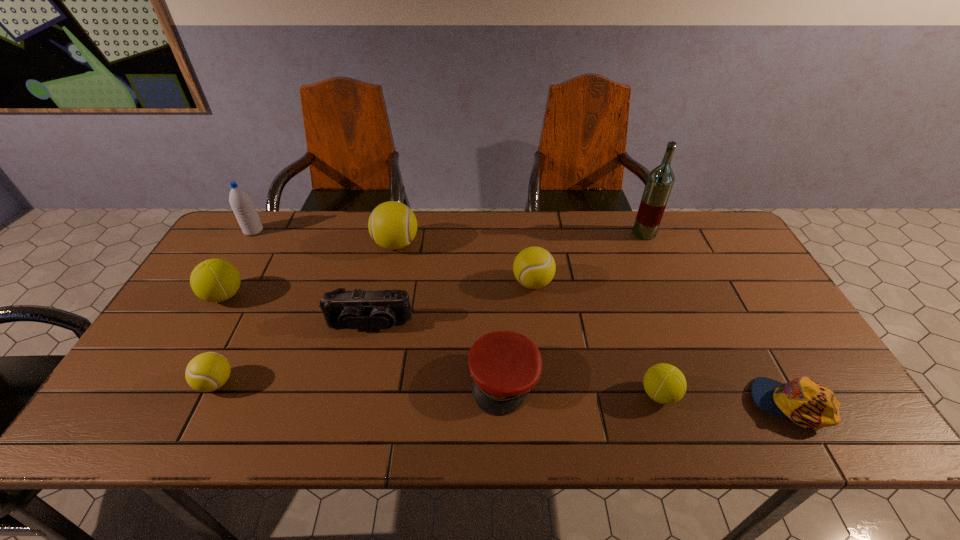
At what (x,y) coordinates should I click in order to perform the action: click on vacant space that's between the rightmost yellow tennis ball and the second object from right to left. Please return your answer as a coordinate pair (x, y). The image size is (960, 540). Looking at the image, I should click on (588, 258).

Locate an element on the screen. The width and height of the screenshot is (960, 540). vacant area that lies between the fourth tennis ball from left to right and the nearest yellow tennis ball is located at coordinates (374, 333).

In order to click on empty location between the blue water bottle and the left green tennis ball in this screenshot , I will do (239, 263).

This screenshot has height=540, width=960. Identify the location of empty space that is in between the leftmost yellow tennis ball and the water bottle. (235, 307).

Locate an element on the screen. The width and height of the screenshot is (960, 540). vacant space that is in between the green liquor and the nearest yellow tennis ball is located at coordinates (430, 308).

Where is `vacant space that's between the second nearest yellow tennis ball and the second tallest object`? The height and width of the screenshot is (540, 960). vacant space that's between the second nearest yellow tennis ball and the second tallest object is located at coordinates (394, 257).

Where is `vacant space that is in between the second nearest yellow tennis ball and the tallest tennis ball`? This screenshot has height=540, width=960. vacant space that is in between the second nearest yellow tennis ball and the tallest tennis ball is located at coordinates (465, 264).

The height and width of the screenshot is (540, 960). What are the coordinates of `vacant area that lies between the ninth shortest object and the nearest yellow tennis ball` in the screenshot? It's located at (235, 307).

Locate an element on the screen. This screenshot has width=960, height=540. object that stands as the ninth closest to the left green tennis ball is located at coordinates (803, 401).

Identify the location of object that is the closest to the liquor. (534, 267).